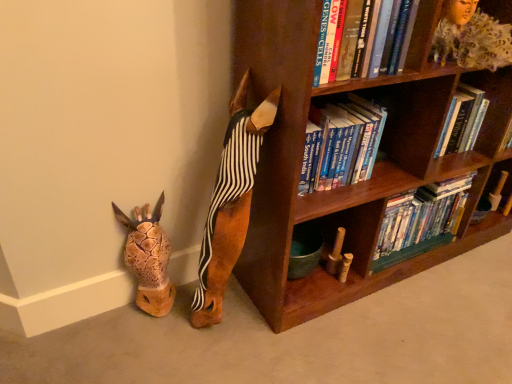
Question: Does brown wooden bookcase at upper right have a lesser height compared to wooden bookshelf at upper right?

Choices:
 (A) no
 (B) yes

Answer: (A)

Question: Could you tell me if brown wooden bookcase at upper right is turned towards wooden bookshelf at upper right?

Choices:
 (A) yes
 (B) no

Answer: (A)

Question: Does brown wooden bookcase at upper right come behind wooden bookshelf at upper right?

Choices:
 (A) no
 (B) yes

Answer: (A)

Question: From the image's perspective, is brown wooden bookcase at upper right below wooden bookshelf at upper right?

Choices:
 (A) no
 (B) yes

Answer: (B)

Question: Does brown wooden bookcase at upper right have a greater width compared to wooden bookshelf at upper right?

Choices:
 (A) yes
 (B) no

Answer: (A)

Question: Based on their positions, is hardcover books at upper right located to the left or right of brown wooden bookcase at upper right?

Choices:
 (A) right
 (B) left

Answer: (A)

Question: In terms of width, does hardcover books at upper right look wider or thinner when compared to brown wooden bookcase at upper right?

Choices:
 (A) wide
 (B) thin

Answer: (B)

Question: In terms of height, does hardcover books at upper right look taller or shorter compared to brown wooden bookcase at upper right?

Choices:
 (A) short
 (B) tall

Answer: (A)

Question: Considering the positions of hardcover books at upper right and brown wooden bookcase at upper right in the image, is hardcover books at upper right bigger or smaller than brown wooden bookcase at upper right?

Choices:
 (A) big
 (B) small

Answer: (B)

Question: Considering the positions of hardcover books at center, positioned as the first book in bottom-to-top order, and hardcover books at upper right in the image, is hardcover books at center, positioned as the first book in bottom-to-top order, taller or shorter than hardcover books at upper right?

Choices:
 (A) short
 (B) tall

Answer: (B)

Question: From the image's perspective, is hardcover books at center, the 1th book from the back, positioned above or below hardcover books at upper right?

Choices:
 (A) below
 (B) above

Answer: (A)

Question: Is hardcover books at center, the 1th book from the back, bigger or smaller than hardcover books at upper right?

Choices:
 (A) big
 (B) small

Answer: (A)

Question: Do you think hardcover books at center, the second book when ordered from front to back, is within hardcover books at upper right, or outside of it?

Choices:
 (A) inside
 (B) outside

Answer: (B)

Question: In terms of size, does wooden bookshelf at upper right appear bigger or smaller than hardcover books at center, positioned as the first book in bottom-to-top order?

Choices:
 (A) big
 (B) small

Answer: (B)

Question: From the image's perspective, is wooden bookshelf at upper right located above or below hardcover books at center, which ranks as the 2th book in top-to-bottom order?

Choices:
 (A) below
 (B) above

Answer: (B)